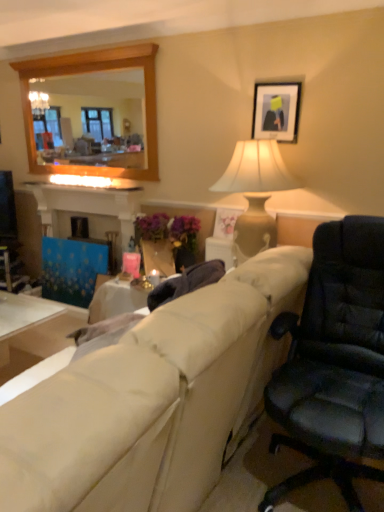
Image resolution: width=384 pixels, height=512 pixels. What are the coordinates of `wooden frame mirror at upper left` in the screenshot? It's located at (91, 119).

The image size is (384, 512). Identify the location of beige fabric couch at center. (153, 400).

Is matte beige vase at center at the right side of matte black picture frame at upper center?

Incorrect, matte beige vase at center is not on the right side of matte black picture frame at upper center.

How many degrees apart are the facing directions of matte beige vase at center and matte black picture frame at upper center?

The angular difference between matte beige vase at center and matte black picture frame at upper center is 0.00363 degrees.

Between matte beige vase at center and matte black picture frame at upper center, which one has smaller width?

matte black picture frame at upper center.

Looking at the image, does matte black picture frame at upper center seem bigger or smaller compared to beige fabric couch at center?

Clearly, matte black picture frame at upper center is smaller in size than beige fabric couch at center.

From the image's perspective, is matte black picture frame at upper center above or below beige fabric couch at center?

Based on their image positions, matte black picture frame at upper center is located above beige fabric couch at center.

Is point (293, 123) less distant than point (179, 387)?

No, (293, 123) is behind (179, 387).

Looking at this image, considering the sizes of objects wooden frame mirror at upper left and white glossy table at lower left in the image provided, who is smaller, wooden frame mirror at upper left or white glossy table at lower left?

wooden frame mirror at upper left.

What's the angular difference between wooden frame mirror at upper left and white glossy table at lower left's facing directions?

They differ by 0.51 degrees in their facing directions.

Does wooden frame mirror at upper left turn towards white glossy table at lower left?

No, wooden frame mirror at upper left is not oriented towards white glossy table at lower left.

Does matte black picture frame at upper center lie in front of white glossy table at lower left?

No.

How far apart are matte black picture frame at upper center and white glossy table at lower left?

The distance of matte black picture frame at upper center from white glossy table at lower left is 6.54 feet.

Can you tell me how much matte black picture frame at upper center and white glossy table at lower left differ in facing direction?

The facing directions of matte black picture frame at upper center and white glossy table at lower left are 0.509 degrees apart.

From the image's perspective, is matte black picture frame at upper center on white glossy table at lower left?

Yes, from the image's perspective, matte black picture frame at upper center is above white glossy table at lower left.

Is beige fabric couch at center taller or shorter than white glossy table at lower left?

In the image, beige fabric couch at center appears to be taller than white glossy table at lower left.

Based on the photo, is beige fabric couch at center in contact with white glossy table at lower left?

No, beige fabric couch at center is not in contact with white glossy table at lower left.

Is point (170, 309) closer or farther from the camera than point (10, 318)?

Clearly, point (170, 309) is closer to the camera than point (10, 318).

What's the angular difference between beige fabric couch at center and white glossy table at lower left's facing directions?

They differ by 90.5 degrees in their facing directions.

Consider the image. From a real-world perspective, does matte beige vase at center stand above beige fabric couch at center?

Yes, from a real-world perspective, matte beige vase at center is over beige fabric couch at center

Is matte beige vase at center oriented away from beige fabric couch at center?

No.

How different are the orientations of matte beige vase at center and beige fabric couch at center in degrees?

The angular difference between matte beige vase at center and beige fabric couch at center is 90 degrees.

Which of these two, matte beige vase at center or beige fabric couch at center, is wider?

beige fabric couch at center.

Based on their sizes in the image, would you say white glossy table at lower left is bigger or smaller than matte black picture frame at upper center?

In the image, white glossy table at lower left appears to be larger than matte black picture frame at upper center.

Is white glossy table at lower left far away from matte black picture frame at upper center?

Yes, white glossy table at lower left and matte black picture frame at upper center are located far from each other.

Can you confirm if white glossy table at lower left is thinner than matte black picture frame at upper center?

Incorrect, the width of white glossy table at lower left is not less than that of matte black picture frame at upper center.

Which is in front, point (45, 317) or point (255, 121)?

The point (45, 317) is more forward.

The width and height of the screenshot is (384, 512). Identify the location of lamp below the matte black picture frame at upper center (from the image's perspective). (254, 194).

Locate an element on the screen. picture frame above the beige fabric couch at center (from the image's perspective) is located at coordinates (276, 111).

From the image, which object appears to be farther from matte beige vase at center, matte black picture frame at upper center or wooden frame mirror at upper left?

wooden frame mirror at upper left is positioned further to the anchor matte beige vase at center.

Estimate the real-world distances between objects in this image. Which object is closer to wooden frame mirror at upper left, matte beige vase at center or beige fabric couch at center?

matte beige vase at center is closer to wooden frame mirror at upper left.

Estimate the real-world distances between objects in this image. Which object is closer to white glossy table at lower left, wooden frame mirror at upper left or matte beige vase at center?

matte beige vase at center lies closer to white glossy table at lower left than the other object.

From the image, which object appears to be nearer to matte beige vase at center, matte black picture frame at upper center or white glossy table at lower left?

matte black picture frame at upper center lies closer to matte beige vase at center than the other object.

Looking at the image, which one is located closer to white glossy table at lower left, beige fabric couch at center or matte black picture frame at upper center?

beige fabric couch at center is closer to white glossy table at lower left.

Based on their spatial positions, is wooden frame mirror at upper left or white glossy table at lower left closer to matte black picture frame at upper center?

white glossy table at lower left.

Based on the photo, which object lies nearer to the anchor point beige fabric couch at center, white glossy table at lower left or matte beige vase at center?

The object closer to beige fabric couch at center is matte beige vase at center.

When comparing their distances from matte beige vase at center, does beige fabric couch at center or white glossy table at lower left seem closer?

The object closer to matte beige vase at center is beige fabric couch at center.

Find the location of a particular element. The height and width of the screenshot is (512, 384). mirror located between white glossy table at lower left and matte beige vase at center in the left-right direction is located at coordinates (91, 119).

I want to click on picture frame between beige fabric couch at center and wooden frame mirror at upper left in the front-back direction, so click(276, 111).

This screenshot has height=512, width=384. I want to click on lamp situated between white glossy table at lower left and matte black picture frame at upper center from left to right, so click(254, 194).

Find the location of a particular element. This screenshot has height=512, width=384. lamp located between beige fabric couch at center and wooden frame mirror at upper left in the depth direction is located at coordinates (254, 194).